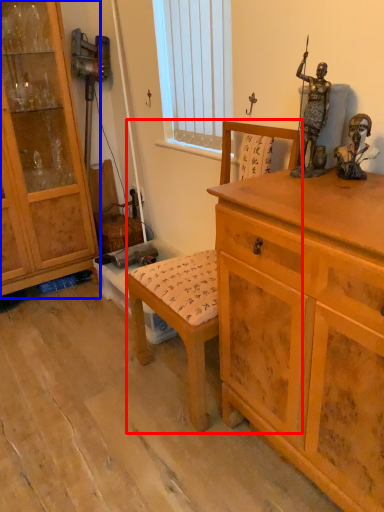
Question: Among these objects, which one is nearest to the camera, rocking chair (highlighted by a red box) or cabinetry (highlighted by a blue box)?

Choices:
 (A) rocking chair
 (B) cabinetry

Answer: (A)